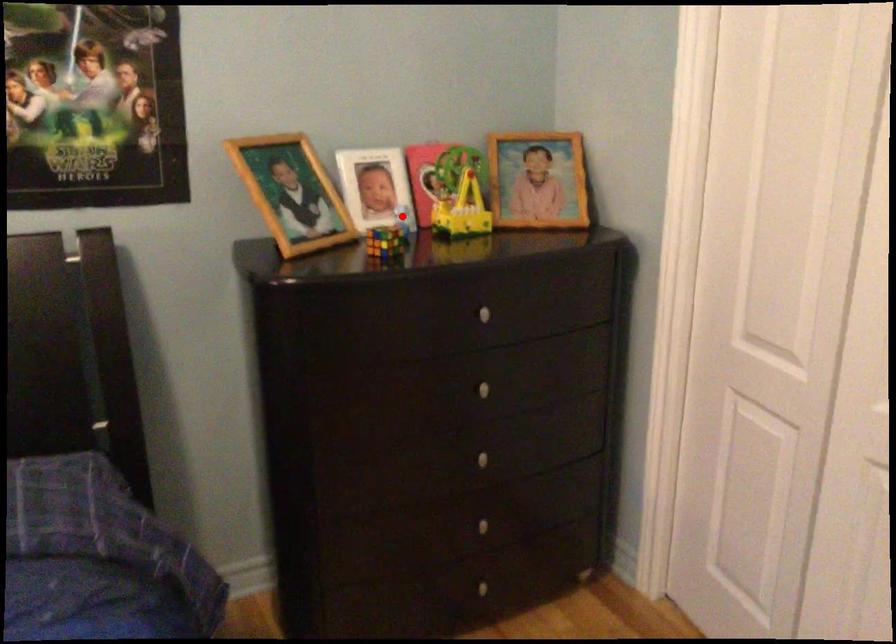
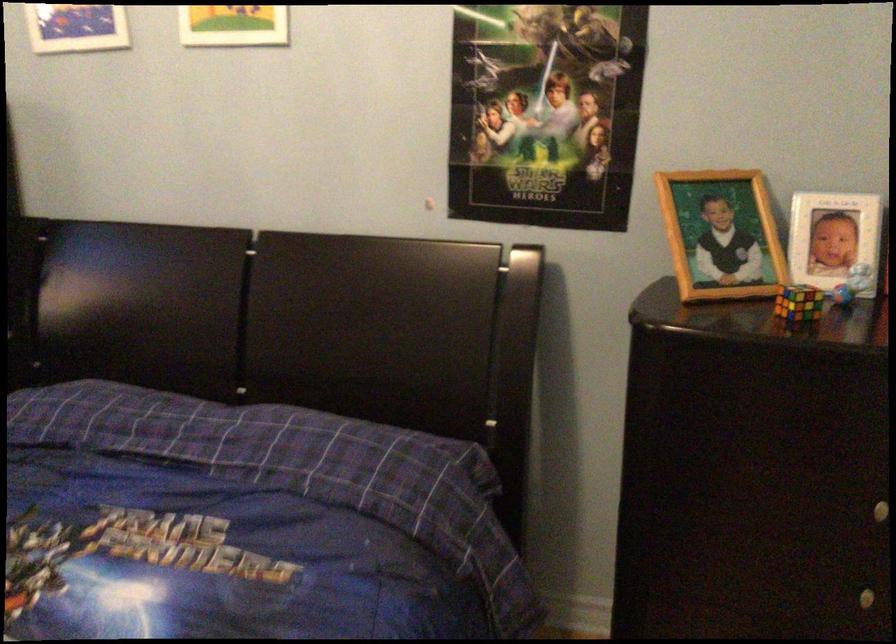
Question: I am providing you with two images of the same scene from different viewpoints. Image1 has a red point marked. In image2, the corresponding 3D location appears at what relative position? Reply with the corresponding letter.

Choices:
 (A) Closer
 (B) Farther

Answer: (A)